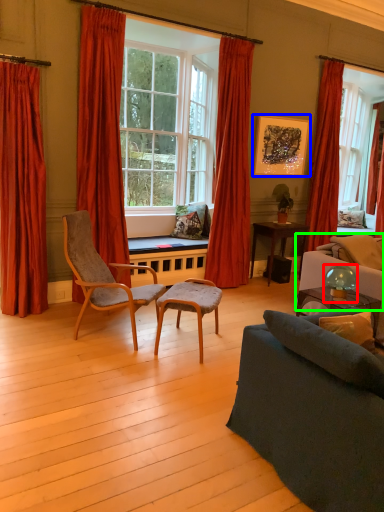
Question: Based on their relative distances, which object is farther from lamp (highlighted by a red box)? Choose from picture frame (highlighted by a blue box) and couch (highlighted by a green box).

Choices:
 (A) picture frame
 (B) couch

Answer: (A)